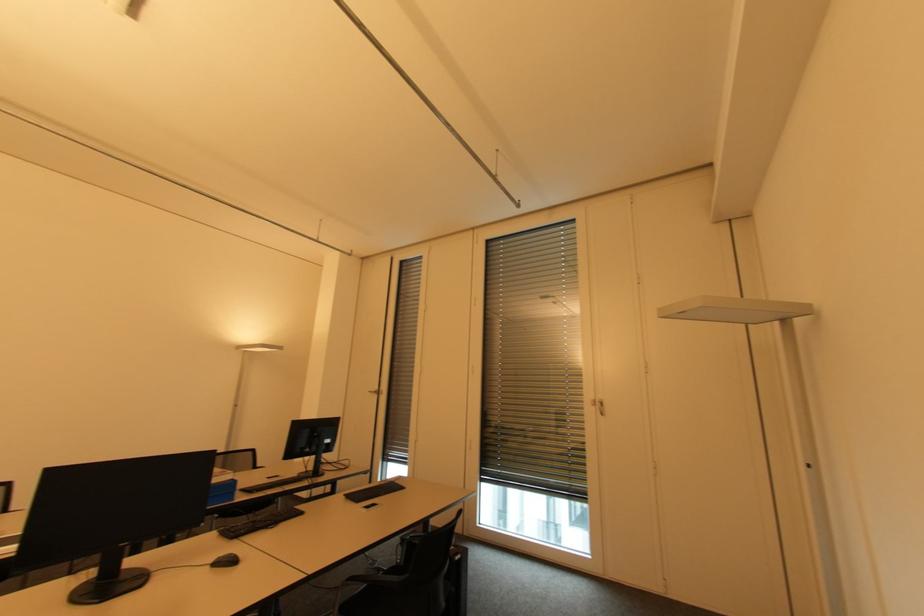
The image size is (924, 616). Identify the location of chair armrest. (375, 590).